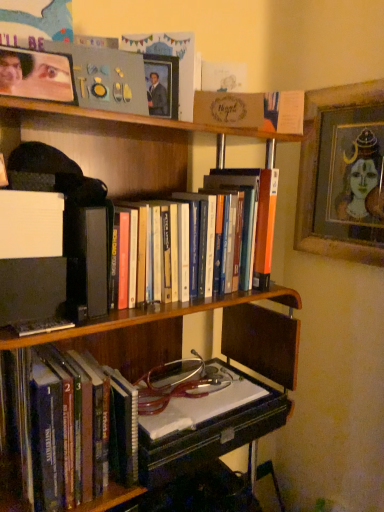
Question: Considering their positions, is hardcover books at left, the first book from the bottom, located in front of or behind hardcover books at center, marked as the 1th book in a top-to-bottom arrangement?

Choices:
 (A) behind
 (B) front

Answer: (A)

Question: Is hardcover books at left, which is the 2th book in top-to-bottom order, inside the boundaries of hardcover books at center, arranged as the second book when ordered from the bottom, or outside?

Choices:
 (A) inside
 (B) outside

Answer: (B)

Question: Which of these objects is positioned closest to the hardcover books at center, marked as the 1th book in a top-to-bottom arrangement?

Choices:
 (A) wooden bookcase at center
 (B) matte plastic picture frame at upper left, which is counted as the third picture frame, starting from the right
 (C) wooden framed portrait at upper right, which appears as the 3th picture frame when viewed from the front
 (D) wooden picture frame at upper center, acting as the 2th picture frame starting from the front
 (E) hardcover books at left, the first book from the bottom

Answer: (A)

Question: Which object is positioned closest to the wooden framed portrait at upper right, the first picture frame viewed from the back?

Choices:
 (A) hardcover books at left, which is the 2th book in top-to-bottom order
 (B) matte plastic picture frame at upper left, the 1th picture frame viewed from the left
 (C) wooden picture frame at upper center, acting as the 2th picture frame starting from the front
 (D) hardcover books at center, marked as the 1th book in a top-to-bottom arrangement
 (E) wooden bookcase at center

Answer: (E)